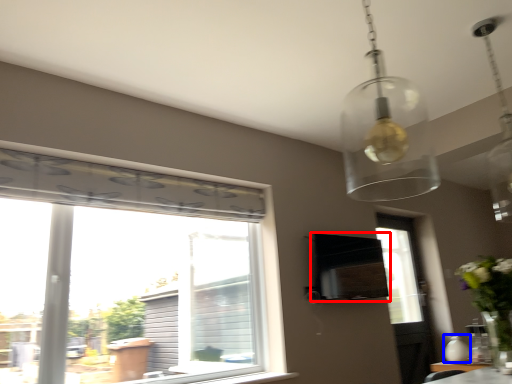
Question: Which of the following is the farthest to the observer, vent (highlighted by a red box) or vase (highlighted by a blue box)?

Choices:
 (A) vent
 (B) vase

Answer: (A)